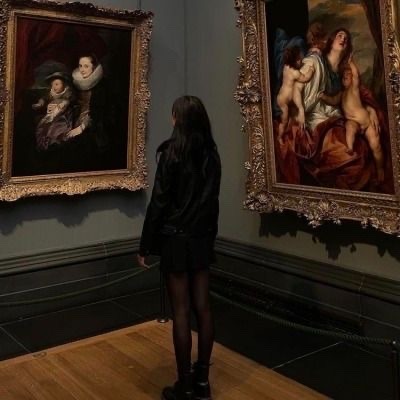
Locate an element on the screen. The image size is (400, 400). fancy picture frames is located at coordinates tap(126, 183), tap(297, 206).